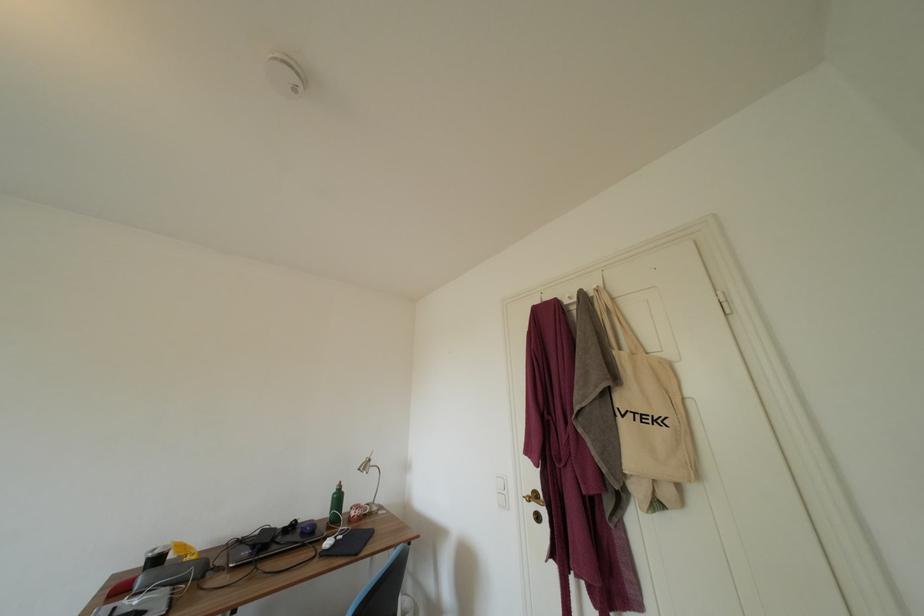
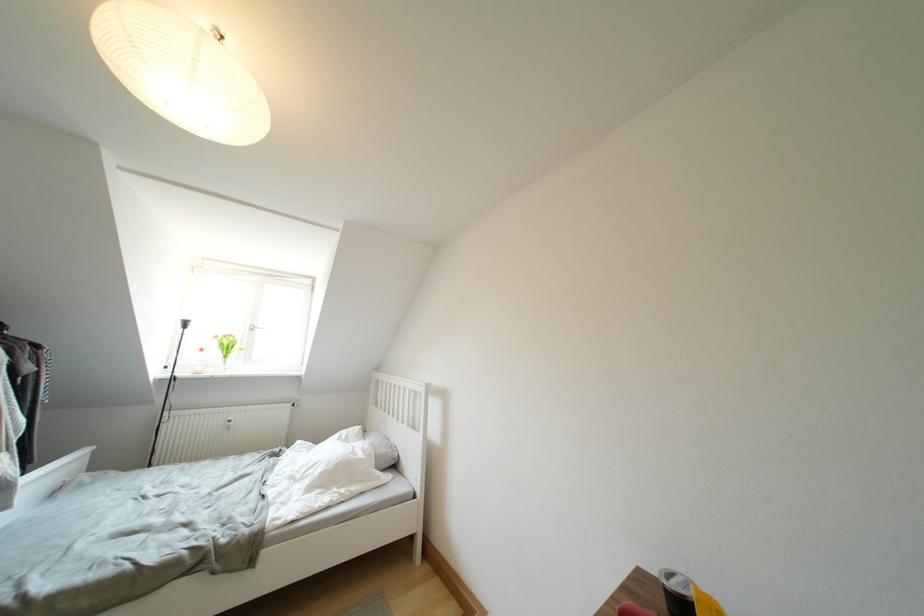
The point at [162,556] is marked in the first image. Where is the corresponding point in the second image?

(678, 589)